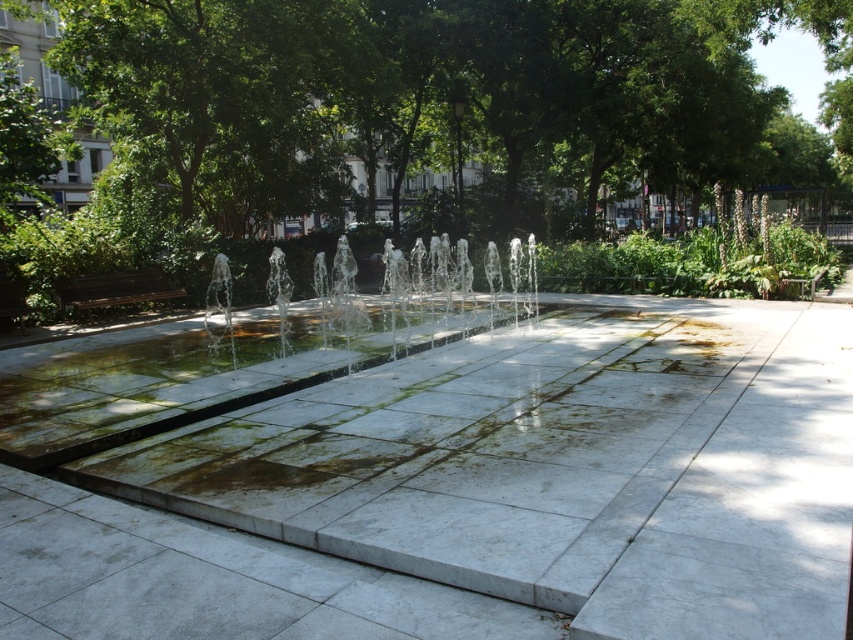
You are a landscape architect designing a new park layout. You need to place a new bench that requires at least 2 meters of space between it and any existing objects. Given the green leafy tree at center and the clear glass water jets at center, which object should the bench be placed farther away from?

The green leafy tree at center might be wider than clear glass water jets at center, so the bench should be placed farther away from the green leafy tree at center to ensure the required 2 meters of space.

You are standing at the entrance of the park and want to find the green leafy tree at center. According to the coordinates provided, which direction should you walk to reach it?

The green leafy tree at center is located at point 0.186 on the x and 0.478 on the y. Since coordinates typically start from the bottom left corner, you should walk towards the right and slightly upwards to reach it.